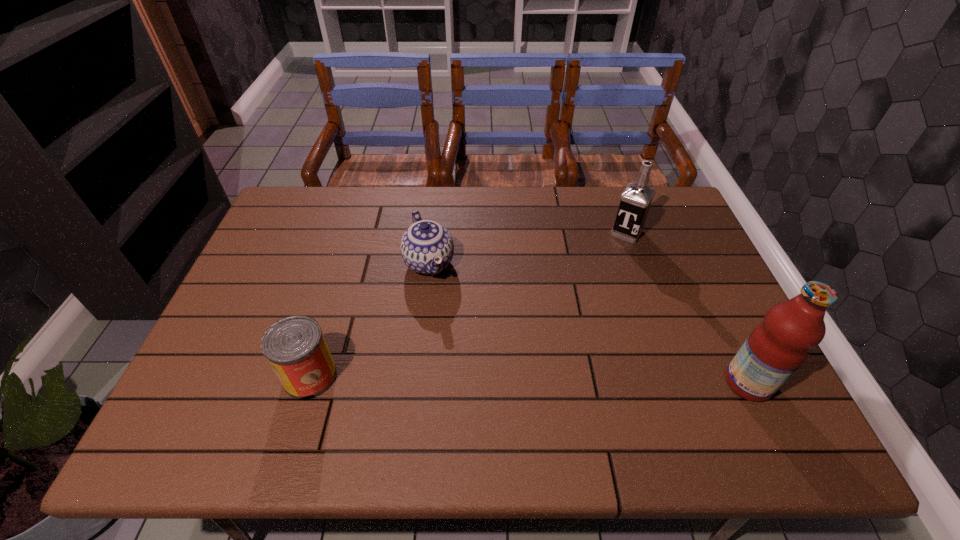
The image size is (960, 540). What are the coordinates of `vacant space in between the fruit juice and the second object from right to left` in the screenshot? It's located at (687, 308).

The height and width of the screenshot is (540, 960). Find the location of `free spot between the rightmost object and the second tallest object`. free spot between the rightmost object and the second tallest object is located at coordinates (687, 308).

Locate an element on the screen. empty location between the leftmost object and the chinaware is located at coordinates (370, 320).

Where is `free spot between the third object from right to left and the leftmost object`? The image size is (960, 540). free spot between the third object from right to left and the leftmost object is located at coordinates coord(370,320).

Find the location of a particular element. free point between the second object from left to right and the second tallest object is located at coordinates (528, 248).

In order to click on vacant area that lies between the can and the second object from right to left in this screenshot , I will do `click(468, 305)`.

You are a GUI agent. You are given a task and a screenshot of the screen. Output one action in this format:
    pyautogui.click(x=<x>, y=<y>)
    Task: Click on the third closest object to the tallest object
    
    Given the screenshot: What is the action you would take?
    [x=295, y=347]

Identify which object is the closest to the chinaware. Please provide its 2D coordinates. Your answer should be formatted as a tuple, i.e. [(x, y)], where the tuple contains the x and y coordinates of a point satisfying the conditions above.

[(295, 347)]

Where is `free space that satisfies the following two spatial constraints: 1. on the back side of the leftmost object; 2. on the left side of the chinaware`? Image resolution: width=960 pixels, height=540 pixels. free space that satisfies the following two spatial constraints: 1. on the back side of the leftmost object; 2. on the left side of the chinaware is located at coordinates (345, 263).

You are a GUI agent. You are given a task and a screenshot of the screen. Output one action in this format:
    pyautogui.click(x=<x>, y=<y>)
    Task: Click on the vacant position in the image that satisfies the following two spatial constraints: 1. on the front side of the can; 2. on the front label of the rightmost object
    The height and width of the screenshot is (540, 960).
    Given the screenshot: What is the action you would take?
    pyautogui.click(x=308, y=383)